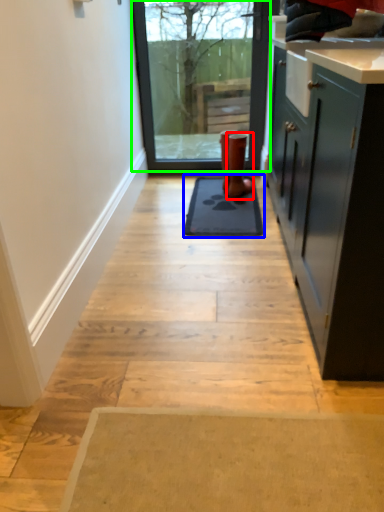
Question: Estimate the real-world distances between objects in this image. Which object is farther from footwear (highlighted by a red box), mat (highlighted by a blue box) or window (highlighted by a green box)?

Choices:
 (A) mat
 (B) window

Answer: (B)